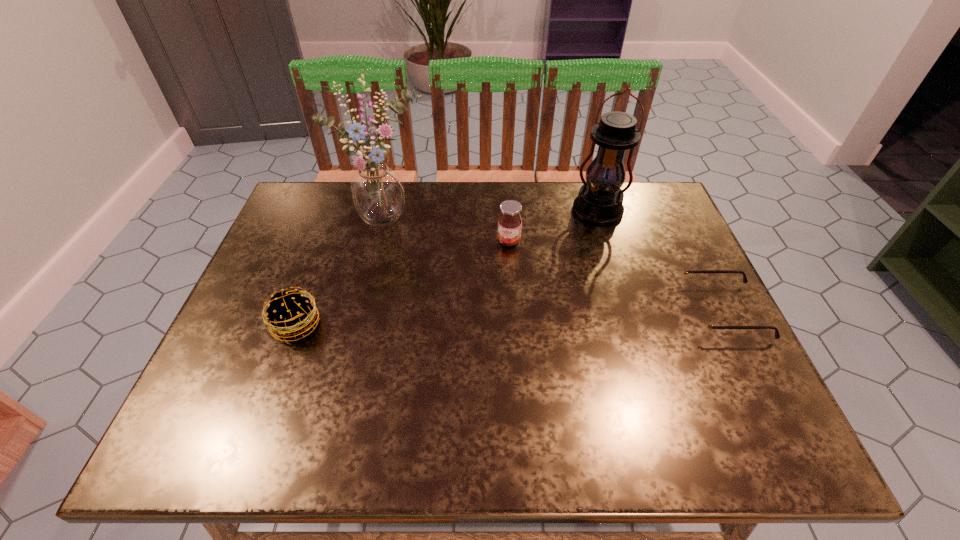
Find the location of `the second shortest object`. the second shortest object is located at coordinates (290, 313).

Where is `the shortest object`? the shortest object is located at coordinates (701, 321).

The image size is (960, 540). In order to click on spectacles in this screenshot , I will do `click(701, 321)`.

The image size is (960, 540). In order to click on lantern in this screenshot , I will do `click(600, 200)`.

I want to click on the second tallest object, so click(600, 200).

The width and height of the screenshot is (960, 540). I want to click on the third object from right to left, so click(509, 222).

What are the coordinates of `jam` in the screenshot? It's located at (509, 222).

Locate an element on the screen. bouquet is located at coordinates (377, 191).

Where is `free spot located on the right of the patty`? The height and width of the screenshot is (540, 960). free spot located on the right of the patty is located at coordinates (495, 325).

Where is `vacant space located 0.070m at the hinge ends of the rightmost object`? Image resolution: width=960 pixels, height=540 pixels. vacant space located 0.070m at the hinge ends of the rightmost object is located at coordinates (656, 312).